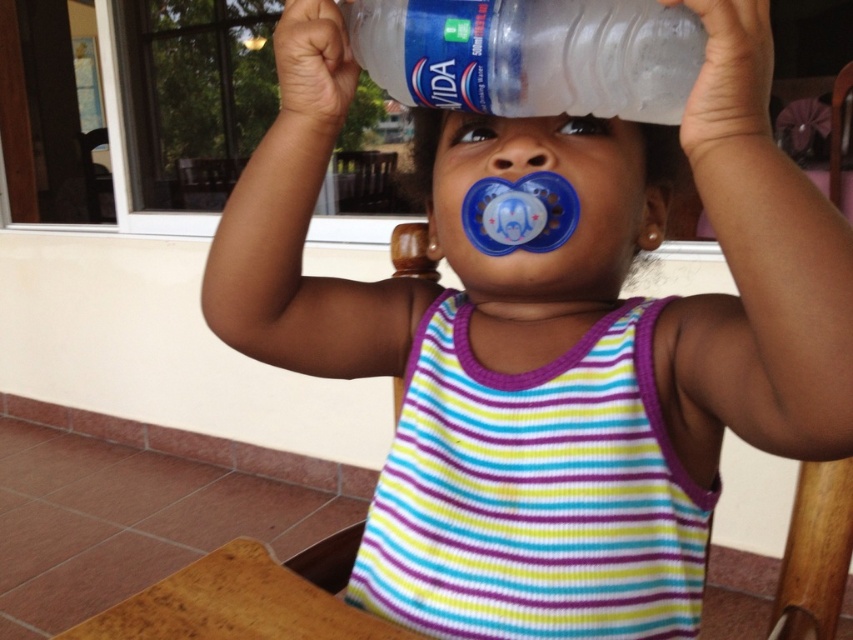
Does transparent plastic bottle at center come in front of matte blue pacifier at center?

Yes, it is.

Describe the element at coordinates (531, 54) in the screenshot. The image size is (853, 640). I see `transparent plastic bottle at center` at that location.

The height and width of the screenshot is (640, 853). I want to click on transparent plastic bottle at center, so click(531, 54).